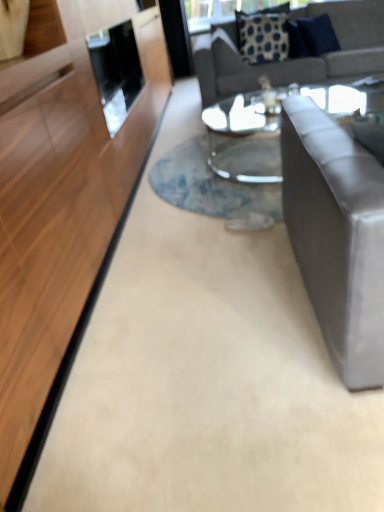
Question: Which is correct: satin gray couch at right, acting as the 1th studio couch starting from the front, is inside blue dotted fabric pillow at upper center, the 1th pillow in the left-to-right sequence, or outside of it?

Choices:
 (A) inside
 (B) outside

Answer: (B)

Question: Is satin gray couch at right, placed as the second studio couch when sorted from top to bottom, wider or thinner than blue dotted fabric pillow at upper center, the 1th pillow in the left-to-right sequence?

Choices:
 (A) thin
 (B) wide

Answer: (B)

Question: Estimate the real-world distances between objects in this image. Which object is farther from the satin gray couch at right, acting as the 1th studio couch starting from the front?

Choices:
 (A) blue fabric pillow at upper right, which is the 2th pillow from left to right
 (B) gray fabric couch at upper right, the second studio couch ordered from the bottom
 (C) clear glass coffee table at center
 (D) blue dotted fabric pillow at upper center, the 1th pillow in the left-to-right sequence

Answer: (A)

Question: Which object is positioned farthest from the blue dotted fabric pillow at upper center, the second pillow in the right-to-left sequence?

Choices:
 (A) satin gray couch at right, placed as the second studio couch when sorted from top to bottom
 (B) blue fabric pillow at upper right, positioned as the 1th pillow in right-to-left order
 (C) clear glass coffee table at center
 (D) gray fabric couch at upper right, which appears as the second studio couch when viewed from the front

Answer: (A)